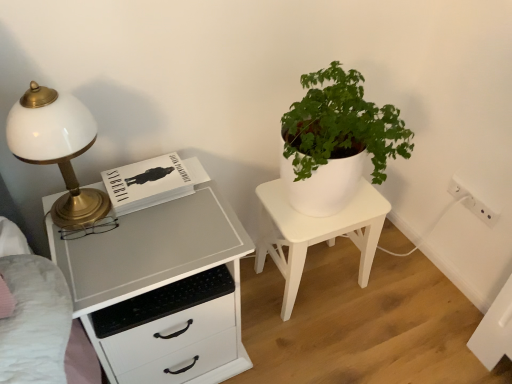
The height and width of the screenshot is (384, 512). I want to click on free space above white glossy chest of drawers at left (from a real-world perspective), so click(147, 233).